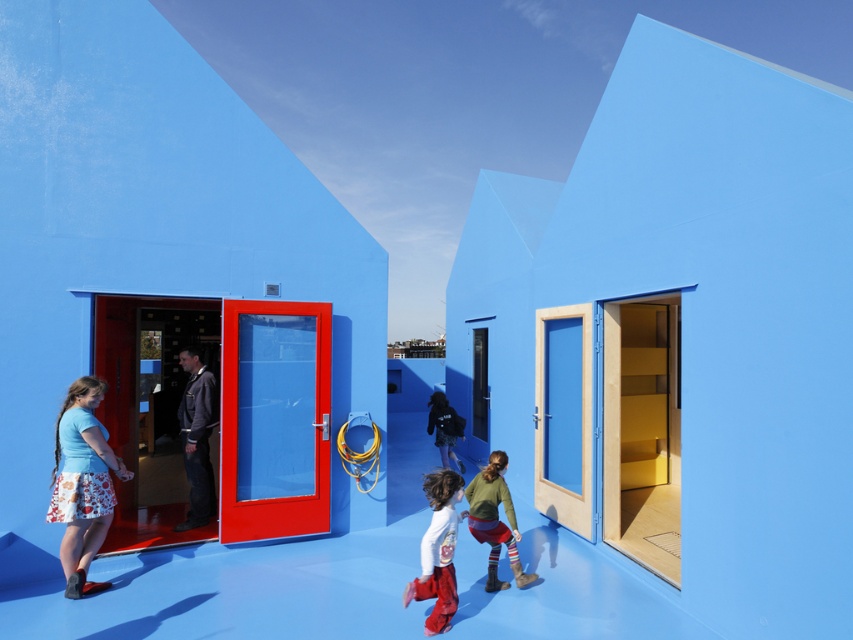
Is matte white shirt at center bigger than matte black jacket at center?

No, matte white shirt at center is not bigger than matte black jacket at center.

Is matte white shirt at center above matte black jacket at center?

Incorrect, matte white shirt at center is not positioned above matte black jacket at center.

This screenshot has height=640, width=853. Identify the location of matte white shirt at center. (438, 550).

Is point (492, 458) farther from camera compared to point (432, 401)?

No, it is not.

How much distance is there between green knitted sweater at center and matte black jacket at center?

green knitted sweater at center is 3.23 meters from matte black jacket at center.

Describe the element at coordinates (494, 520) in the screenshot. The image size is (853, 640). I see `green knitted sweater at center` at that location.

The height and width of the screenshot is (640, 853). Find the location of `green knitted sweater at center`. green knitted sweater at center is located at coordinates (494, 520).

Where is `matte white shirt at center`? The height and width of the screenshot is (640, 853). matte white shirt at center is located at coordinates (438, 550).

Who is shorter, matte white shirt at center or green knitted sweater at center?

Standing shorter between the two is matte white shirt at center.

Who is more distant from viewer, (450,604) or (480,490)?

Positioned behind is point (480,490).

At what (x,y) coordinates should I click in order to perform the action: click on matte white shirt at center. Please return your answer as a coordinate pair (x, y). Image resolution: width=853 pixels, height=640 pixels. Looking at the image, I should click on (438, 550).